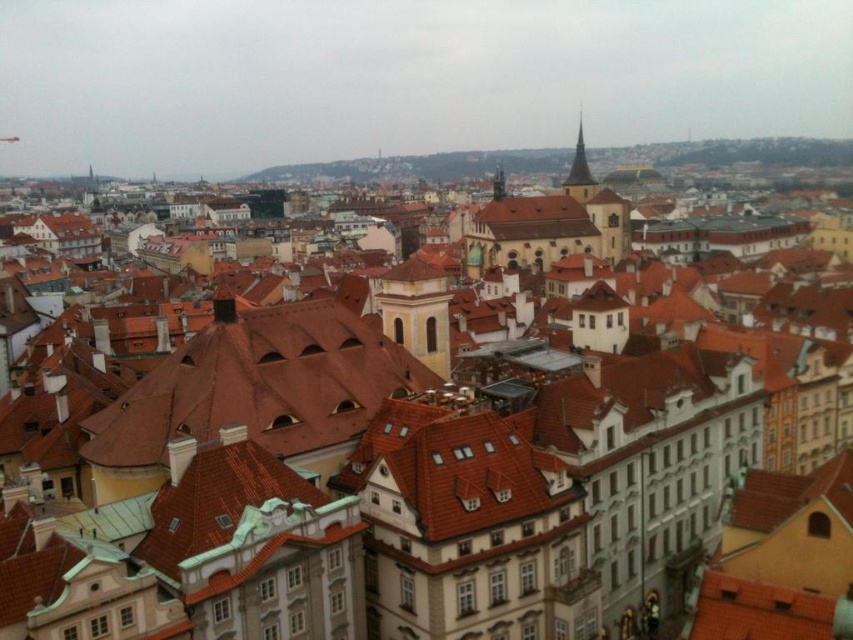
Question: Which of the following is the farthest from the observer?

Choices:
 (A) (582, 164)
 (B) (218, 358)

Answer: (A)

Question: Does brown tile roof at center appear under smooth stone tower at center?

Choices:
 (A) yes
 (B) no

Answer: (A)

Question: Which point is farther to the camera?

Choices:
 (A) smooth stone tower at center
 (B) smooth stone spire at upper right
 (C) brown tile roof at center

Answer: (B)

Question: Based on their relative distances, which object is farther from the brown tile roof at center?

Choices:
 (A) smooth stone spire at upper right
 (B) smooth stone tower at center

Answer: (A)

Question: Can you confirm if smooth stone spire at upper right is thinner than smooth stone tower at center?

Choices:
 (A) yes
 (B) no

Answer: (B)

Question: Is brown tile roof at center bigger than smooth stone tower at center?

Choices:
 (A) no
 (B) yes

Answer: (A)